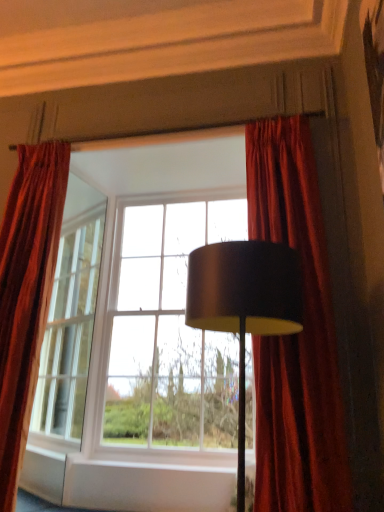
Question: Is velvet red curtain at left, which appears as the 2th curtain when viewed from the right, smaller than matte black lampshade at center?

Choices:
 (A) yes
 (B) no

Answer: (B)

Question: From the image's perspective, is velvet red curtain at left, placed as the first curtain when sorted from left to right, below matte black lampshade at center?

Choices:
 (A) no
 (B) yes

Answer: (A)

Question: From a real-world perspective, is velvet red curtain at left, placed as the first curtain when sorted from left to right, over matte black lampshade at center?

Choices:
 (A) no
 (B) yes

Answer: (B)

Question: Can you confirm if velvet red curtain at left, placed as the first curtain when sorted from left to right, is wider than matte black lampshade at center?

Choices:
 (A) yes
 (B) no

Answer: (B)

Question: Considering the relative positions of velvet red curtain at left, which appears as the 2th curtain when viewed from the right, and matte black lampshade at center in the image provided, is velvet red curtain at left, which appears as the 2th curtain when viewed from the right, to the left of matte black lampshade at center from the viewer's perspective?

Choices:
 (A) no
 (B) yes

Answer: (B)

Question: Is velvet red curtain at left, which appears as the 2th curtain when viewed from the right, to the right of matte black lampshade at center from the viewer's perspective?

Choices:
 (A) no
 (B) yes

Answer: (A)

Question: Is matte glass window at center thinner than matte black lampshade at center?

Choices:
 (A) yes
 (B) no

Answer: (B)

Question: From a real-world perspective, is matte glass window at center over matte black lampshade at center?

Choices:
 (A) no
 (B) yes

Answer: (B)

Question: From the image's perspective, is matte glass window at center under matte black lampshade at center?

Choices:
 (A) yes
 (B) no

Answer: (B)

Question: Does matte glass window at center appear on the left side of matte black lampshade at center?

Choices:
 (A) yes
 (B) no

Answer: (A)

Question: Considering the relative sizes of matte glass window at center and matte black lampshade at center in the image provided, is matte glass window at center shorter than matte black lampshade at center?

Choices:
 (A) no
 (B) yes

Answer: (A)

Question: Is matte glass window at center not within matte black lampshade at center?

Choices:
 (A) no
 (B) yes

Answer: (B)

Question: Does matte glass window at center appear on the left side of velvet red curtain at left, placed as the first curtain when sorted from left to right?

Choices:
 (A) no
 (B) yes

Answer: (A)